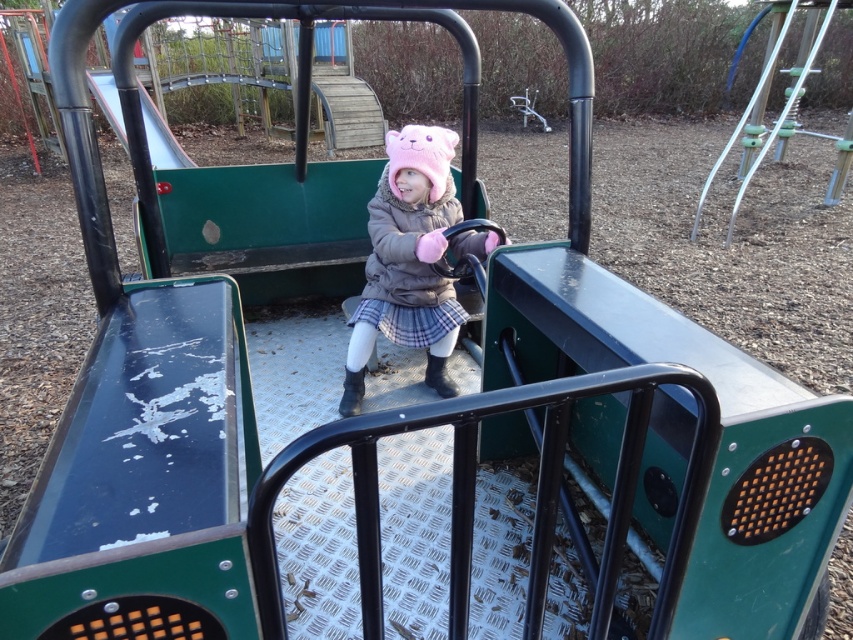
You are a parent looking for your child in the playground. You see the pink fuzzy hat at center and the smooth metal slide at upper left. Which object is closer to the right side of the image?

The pink fuzzy hat at center is closer to the right side of the image because it is positioned to the right of the smooth metal slide at upper left.

You are a parent supervising your child at the playground. You notice the pink fuzzy hat at center and the smooth metal slide at upper left. Which object is closer to the ground?

The pink fuzzy hat at center is positioned under the smooth metal slide at upper left, meaning it is closer to the ground than the slide.

You are a photographer trying to capture a photo of the child wearing the pink fuzzy hat at center and the smooth metal slide at upper left. If you want to ensure both objects are clearly visible in the frame, which object should you focus on first considering their sizes?

The pink fuzzy hat at center has a smaller width than the smooth metal slide at upper left, so you should focus on the smooth metal slide at upper left first to ensure both are in focus.